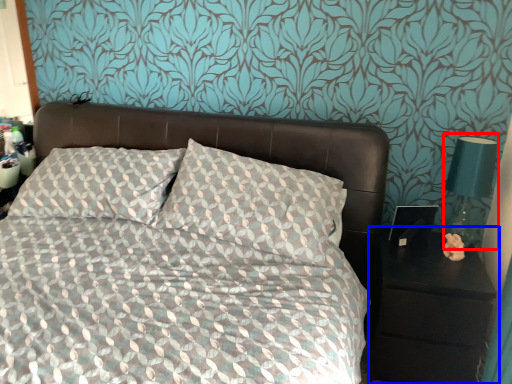
Question: Which of the following is the closest to the observer, bedside lamp (highlighted by a red box) or nightstand (highlighted by a blue box)?

Choices:
 (A) bedside lamp
 (B) nightstand

Answer: (B)